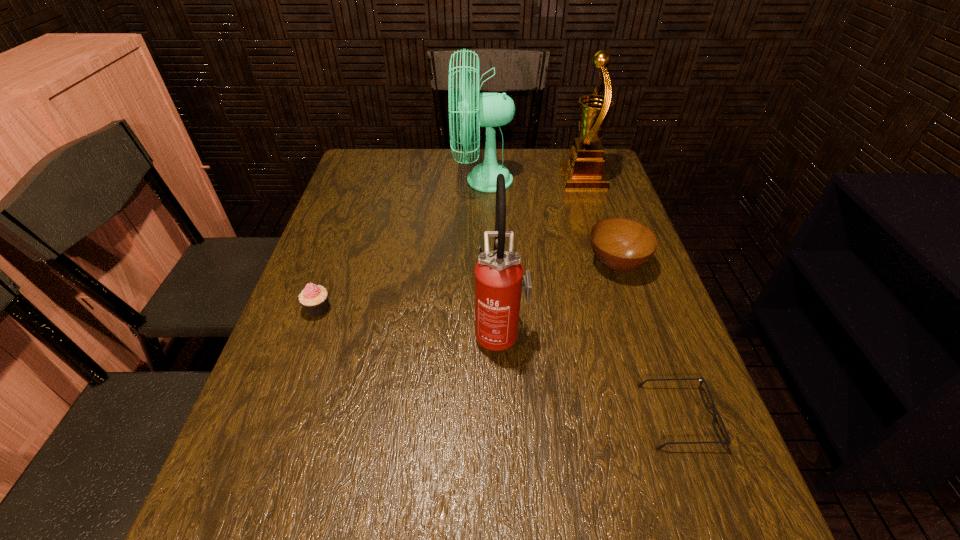
Where is `free spot located on the front-facing side of the award`? This screenshot has height=540, width=960. free spot located on the front-facing side of the award is located at coordinates (518, 178).

Find the location of a particular element. vacant space located on the front-facing side of the award is located at coordinates coord(487,178).

Image resolution: width=960 pixels, height=540 pixels. I want to click on free region located 0.400m on the front-facing side of the award, so click(437, 178).

This screenshot has height=540, width=960. In order to click on vacant area situated at the nozzle of the fire extinguisher in this screenshot , I will do `click(314, 332)`.

Locate an element on the screen. This screenshot has width=960, height=540. free point located at the nozzle of the fire extinguisher is located at coordinates (324, 332).

Locate an element on the screen. The height and width of the screenshot is (540, 960). vacant space located 0.130m at the nozzle of the fire extinguisher is located at coordinates (416, 332).

Where is `vacant area located 0.180m on the back of the third farthest object`? vacant area located 0.180m on the back of the third farthest object is located at coordinates (597, 205).

Where is `vacant space located 0.260m on the back of the leftmost object`? vacant space located 0.260m on the back of the leftmost object is located at coordinates click(347, 230).

Image resolution: width=960 pixels, height=540 pixels. What are the coordinates of `fan that is positioned at the far edge` in the screenshot? It's located at (493, 109).

Where is `award at the far edge`? The image size is (960, 540). award at the far edge is located at coordinates (584, 170).